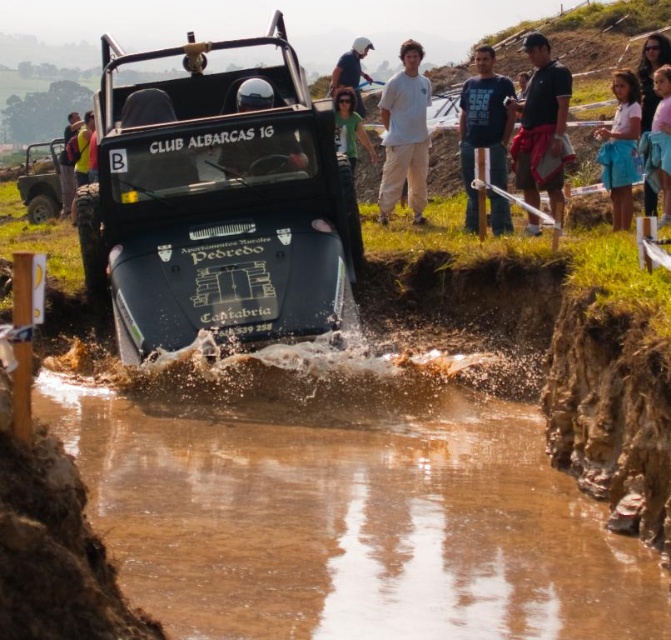
Question: Is black fabric shirt at upper right thinner than dark blue t-shirt at center?

Choices:
 (A) yes
 (B) no

Answer: (A)

Question: Does matte black jeep at center appear under shiny black helmet at center?

Choices:
 (A) yes
 (B) no

Answer: (A)

Question: Which object is closer to the camera taking this photo?

Choices:
 (A) pink fabric shorts at right
 (B) white helmet at upper center

Answer: (A)

Question: From the image, what is the correct spatial relationship of matte black jeep at center in relation to shiny black helmet at center?

Choices:
 (A) right
 (B) left

Answer: (B)

Question: Which is farther from the white helmet at upper center?

Choices:
 (A) white cotton shirt at upper right
 (B) shiny black helmet at center
 (C) matte black jeep at center

Answer: (C)

Question: Which of the following is the farthest from the observer?

Choices:
 (A) (74, 118)
 (B) (321, 621)
 (C) (354, 136)
 (D) (354, 65)

Answer: (A)